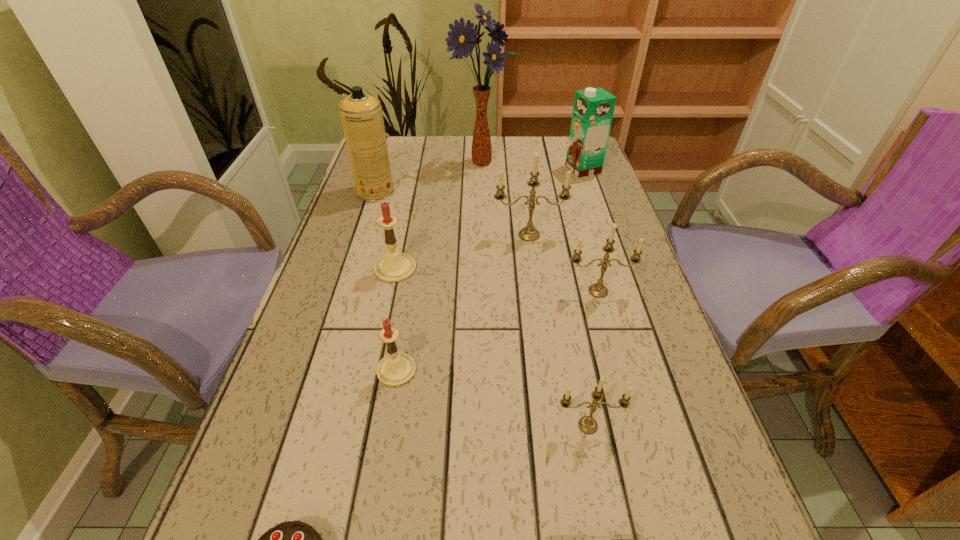
This screenshot has width=960, height=540. Identify the location of the tallest object. (463, 39).

At what (x,y) coordinates should I click in order to perform the action: click on flower arrangement. Please return your answer as a coordinate pair (x, y). The height and width of the screenshot is (540, 960). Looking at the image, I should click on (463, 39).

Find the location of `the third farthest object`. the third farthest object is located at coordinates (361, 115).

Find the location of a particular element. aerosol can is located at coordinates (361, 115).

Locate an element on the screen. The image size is (960, 540). carton is located at coordinates (593, 109).

At what (x,y) coordinates should I click in order to perform the action: click on the seventh nearest object. Please return your answer as a coordinate pair (x, y). Looking at the image, I should click on (529, 233).

At what (x,y) coordinates should I click in order to perform the action: click on the farthest candle. Please return your answer as a coordinate pair (x, y). Image resolution: width=960 pixels, height=540 pixels. Looking at the image, I should click on (529, 233).

The height and width of the screenshot is (540, 960). What are the coordinates of `the farther red candle` in the screenshot? It's located at (393, 267).

In order to click on the second farthest candle in this screenshot , I will do `click(393, 267)`.

This screenshot has width=960, height=540. I want to click on the sixth farthest object, so click(x=598, y=290).